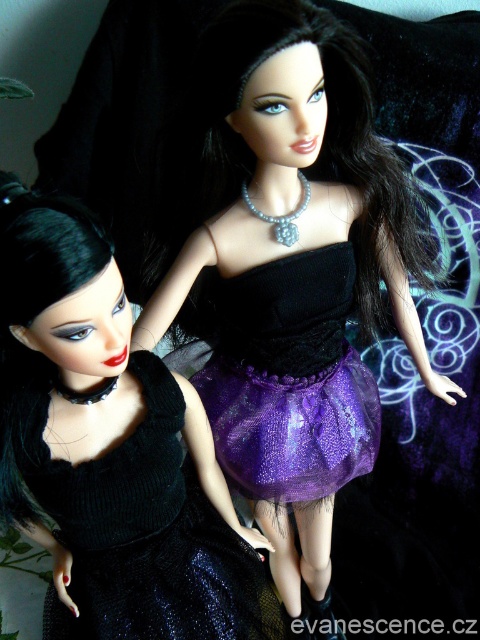
The width and height of the screenshot is (480, 640). What do you see at coordinates (290, 272) in the screenshot?
I see `matte black dress at center` at bounding box center [290, 272].

Locate an element on the screen. The width and height of the screenshot is (480, 640). matte black dress at center is located at coordinates (290, 272).

Can you confirm if matte black dress at center is thinner than black velvet dress at left?

In fact, matte black dress at center might be wider than black velvet dress at left.

Which is behind, point (276, 573) or point (80, 496)?

Point (276, 573)

Locate an element on the screen. The height and width of the screenshot is (640, 480). matte black dress at center is located at coordinates (290, 272).

Can you confirm if black velvet dress at left is shorter than purple tulle skirt at center?

In fact, black velvet dress at left may be taller than purple tulle skirt at center.

Who is positioned more to the left, black velvet dress at left or purple tulle skirt at center?

Positioned to the left is black velvet dress at left.

Does point (201, 582) lie in front of point (315, 468)?

That is True.

Find the location of a particular element. black velvet dress at left is located at coordinates (148, 538).